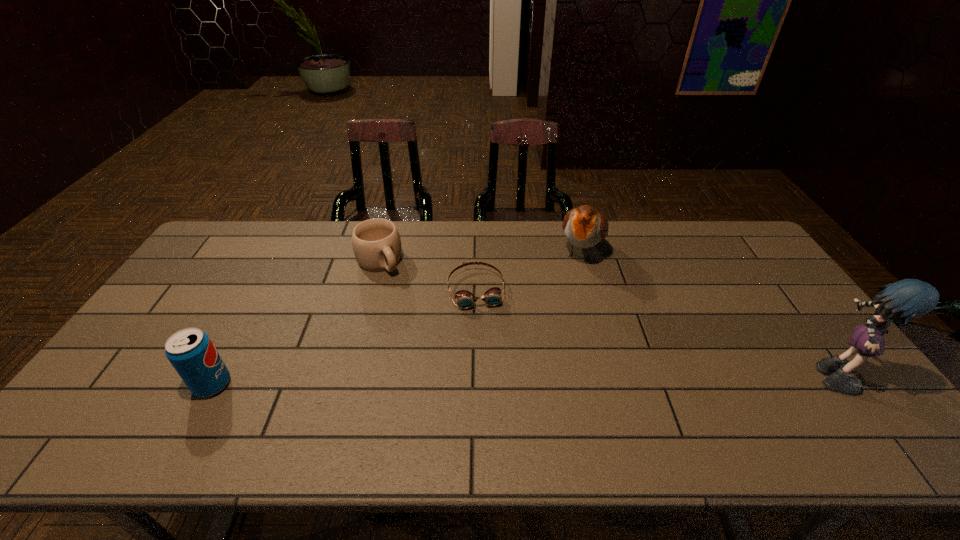
The image size is (960, 540). In order to click on vacant space located on the back of the third shortest object in this screenshot , I will do `click(238, 338)`.

Where is `free location located 0.050m on the side of the second shortest object with the handle`? This screenshot has height=540, width=960. free location located 0.050m on the side of the second shortest object with the handle is located at coordinates (396, 285).

Find the location of a particular element. vacant space located on the side of the second shortest object with the handle is located at coordinates pos(406,298).

This screenshot has height=540, width=960. What are the coordinates of `free region located on the side of the second shortest object with the handle` in the screenshot? It's located at (404, 296).

The height and width of the screenshot is (540, 960). In order to click on free space located at the face of the fourth shortest object in this screenshot , I will do `click(562, 319)`.

The image size is (960, 540). Find the location of `vacant space located at the face of the fourth shortest object`. vacant space located at the face of the fourth shortest object is located at coordinates (546, 363).

Identify the location of blank area located 0.150m at the face of the fourth shortest object. (567, 303).

This screenshot has height=540, width=960. I want to click on blank space located through the lenses of the shortest object, so click(497, 406).

Identify the location of free location located through the lenses of the shortest object. (486, 345).

Locate an element on the screen. This screenshot has height=540, width=960. vacant area situated 0.160m through the lenses of the shortest object is located at coordinates (488, 354).